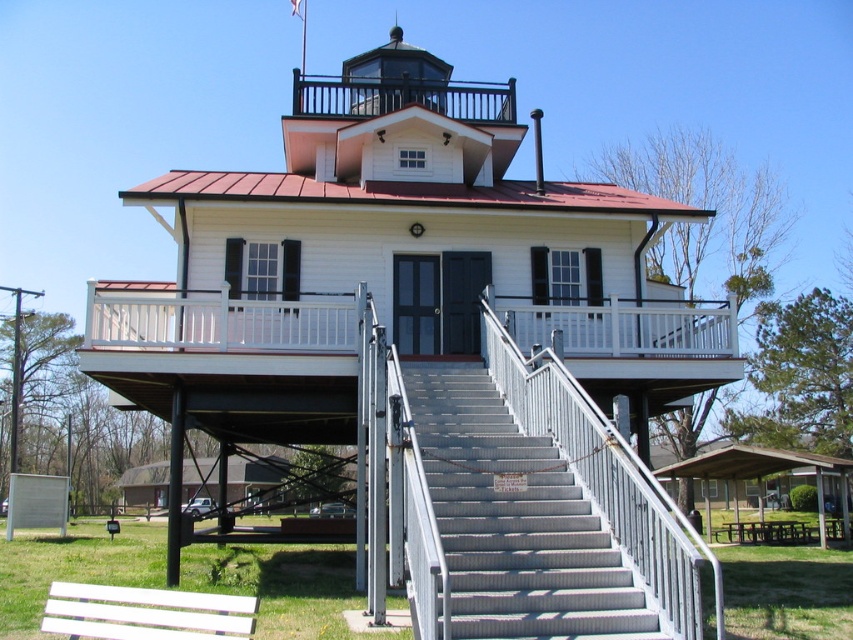
You are a visitor arriving at the lighthouse and want to sit down to rest. You see the metallic gray stairs at center and the white painted wood bench at lower left. Which object is closer to the ground level?

The metallic gray stairs at center is positioned under the white painted wood bench at lower left, meaning the stairs are closer to the ground level than the bench.

You are standing at the base of the lighthouse and want to reach the observation deck on the upper level. The metallic gray stairs at center lead upwards. Given that the average step height is 7 inches, how many steps would you need to climb to reach the observation deck?

The metallic gray stairs at center are 30.59 feet away from the viewer. Converting this to inches gives 30.59 feet x 12 inches per foot equals approximately 367.08 inches. Dividing by the average step height of 7 inches yields about 52.44 steps. Since you can only climb whole steps, you would need to climb approximately 52 steps to reach the observation deck.

You are a maintenance worker needing to move a 10 feet long ladder from the white painted wood bench at lower left to the metallic gray stairs at center. Can you move it horizontally without tilting it?

The distance between the metallic gray stairs at center and the white painted wood bench at lower left is 12.16 feet. Since the ladder is 10 feet long, it can be moved horizontally as the distance is greater than the ladder length.